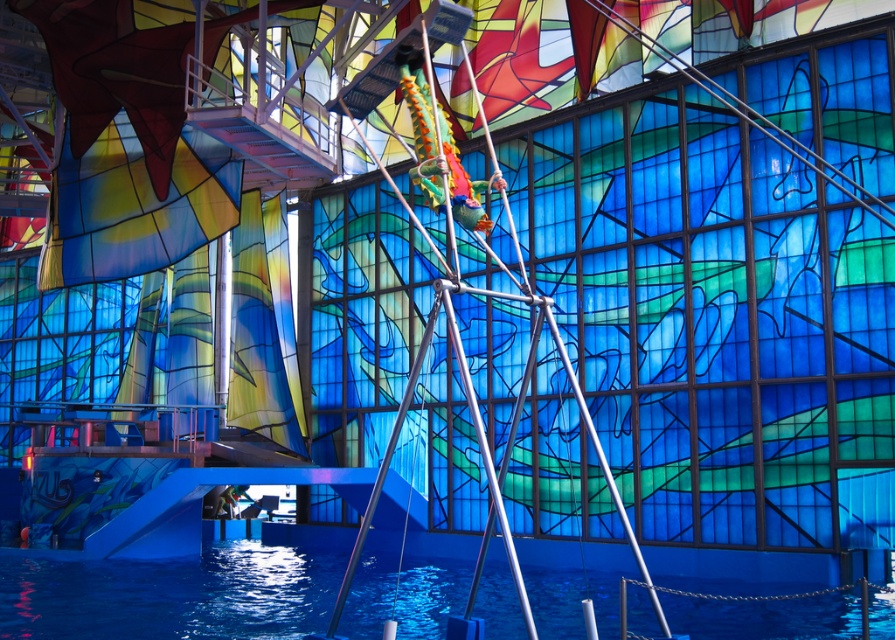
You are a safety inspector checking the aquatic facility. You need to ensure that the metallic silver mast at center is visible from the blue smooth pool at lower center for safety protocols. Is the mast visible from the pool?

The metallic silver mast at center is behind the blue smooth pool at lower center, so it would not be visible from the pool.

You are a swimmer wanting to dive into the blue smooth pool at lower center. There is a metallic silver mast at center nearby. Which direction should you swim to avoid hitting the mast?

The blue smooth pool at lower center is to the left of the metallic silver mast at center, so to avoid hitting the mast, you should swim to the right side of the pool away from the mast.

You are a safety inspector assessing the aquatic facility. You notice the blue smooth pool at lower center and the metallic silver mast at center. According to safety regulations, the pool must be positioned below the mast to prevent water splashing onto electrical components. Does the current setup comply with the safety requirement?

Yes, the blue smooth pool at lower center is positioned below the metallic silver mast at center, which complies with the safety requirement to prevent water splashing onto electrical components.